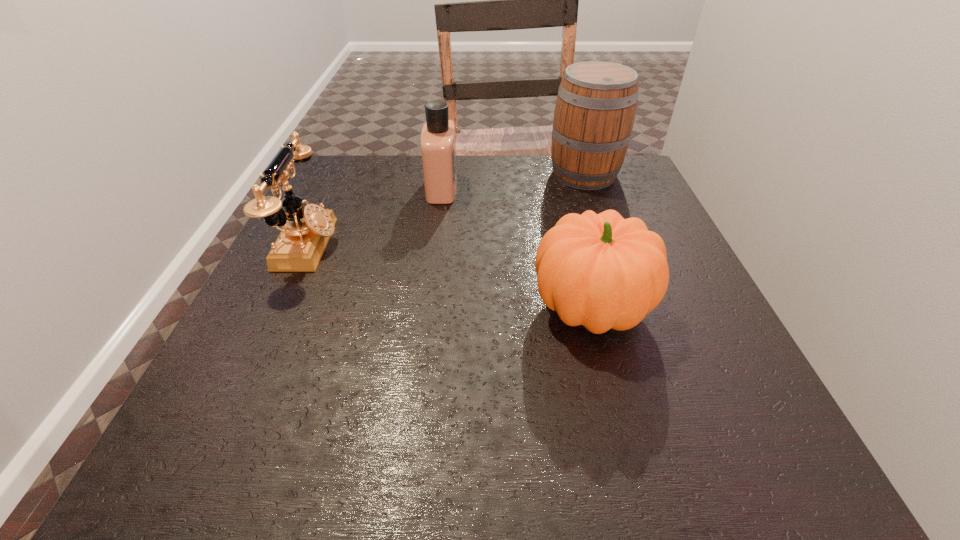
You are a GUI agent. You are given a task and a screenshot of the screen. Output one action in this format:
    pyautogui.click(x=<x>, y=<y>)
    Task: Click on the free location that satisfies the following two spatial constraints: 1. on the dial of the leftmost object; 2. on the right side of the pumpkin
    Image resolution: width=960 pixels, height=540 pixels.
    Given the screenshot: What is the action you would take?
    pyautogui.click(x=279, y=308)